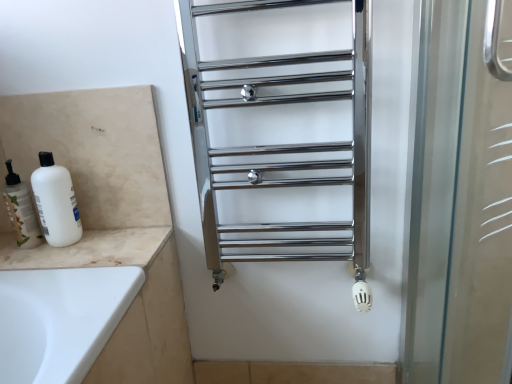
Question: Are white matte bottle at left and beige marble counter top at lower left located far from each other?

Choices:
 (A) no
 (B) yes

Answer: (A)

Question: Is the position of white matte bottle at left more distant than that of beige marble counter top at lower left?

Choices:
 (A) yes
 (B) no

Answer: (A)

Question: Is white matte bottle at left at the left side of beige marble counter top at lower left?

Choices:
 (A) yes
 (B) no

Answer: (A)

Question: Is beige marble counter top at lower left surrounded by white matte bottle at left?

Choices:
 (A) no
 (B) yes

Answer: (A)

Question: Is beige marble counter top at lower left at the back of white matte bottle at left?

Choices:
 (A) yes
 (B) no

Answer: (B)

Question: From a real-world perspective, is polished chrome towel rack at center positioned above or below white matte bottle at left?

Choices:
 (A) below
 (B) above

Answer: (B)

Question: Considering the positions of polished chrome towel rack at center and white matte bottle at left in the image, is polished chrome towel rack at center bigger or smaller than white matte bottle at left?

Choices:
 (A) big
 (B) small

Answer: (A)

Question: In the image, is polished chrome towel rack at center positioned in front of or behind white matte bottle at left?

Choices:
 (A) front
 (B) behind

Answer: (A)

Question: Is polished chrome towel rack at center wider or thinner than white matte bottle at left?

Choices:
 (A) wide
 (B) thin

Answer: (A)

Question: Considering the positions of polished chrome towel rack at center and beige marble counter top at lower left in the image, is polished chrome towel rack at center taller or shorter than beige marble counter top at lower left?

Choices:
 (A) short
 (B) tall

Answer: (B)

Question: Is point (197, 115) positioned closer to the camera than point (106, 259)?

Choices:
 (A) closer
 (B) farther

Answer: (B)

Question: Is polished chrome towel rack at center bigger or smaller than beige marble counter top at lower left?

Choices:
 (A) big
 (B) small

Answer: (A)

Question: From the image's perspective, relative to beige marble counter top at lower left, is polished chrome towel rack at center above or below?

Choices:
 (A) above
 (B) below

Answer: (A)

Question: Considering the relative positions of white matte bottle at left and polished chrome towel rack at center in the image provided, is white matte bottle at left to the left or to the right of polished chrome towel rack at center?

Choices:
 (A) left
 (B) right

Answer: (A)

Question: Is white matte bottle at left taller or shorter than polished chrome towel rack at center?

Choices:
 (A) short
 (B) tall

Answer: (A)